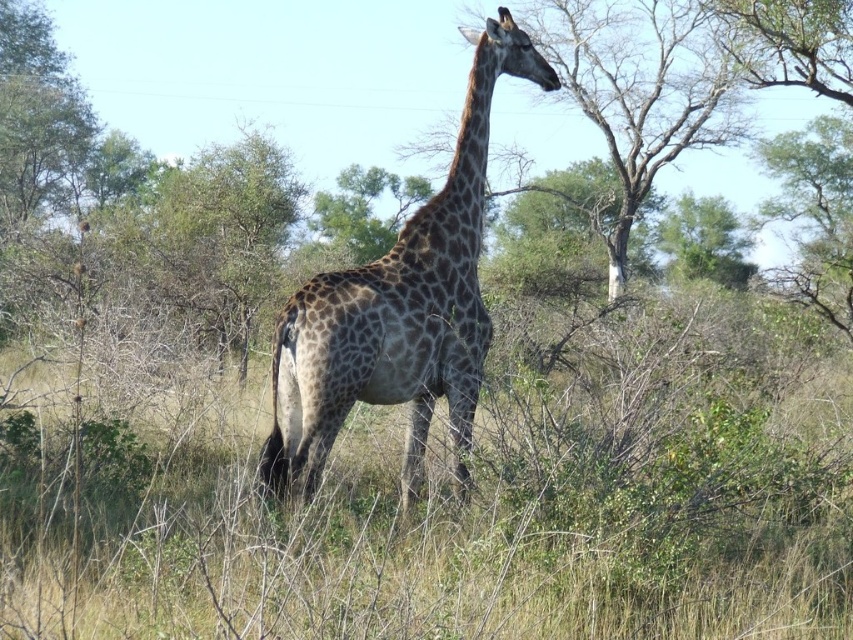
Question: Which point is farther to the camera?

Choices:
 (A) brown textured tree at upper center
 (B) spotted fur giraffe at center

Answer: (A)

Question: Which of the following is the closest to the observer?

Choices:
 (A) (521, 38)
 (B) (653, 13)

Answer: (A)

Question: Does spotted fur giraffe at center appear under brown textured tree at upper center?

Choices:
 (A) yes
 (B) no

Answer: (A)

Question: Does spotted fur giraffe at center appear on the right side of brown textured tree at upper center?

Choices:
 (A) yes
 (B) no

Answer: (B)

Question: Can you confirm if spotted fur giraffe at center is positioned to the right of brown textured tree at upper center?

Choices:
 (A) yes
 (B) no

Answer: (B)